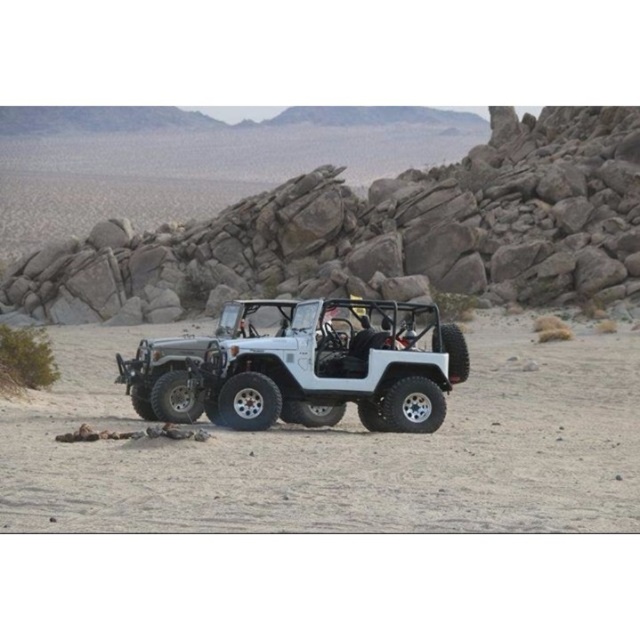
You are planning to set up a campsite in the desert. You have a tent that requires a flat area larger than the white matte jeep at center. Can the white matte sand at center provide enough space for your tent?

The white matte sand at center is bigger than the white matte jeep at center, so yes, the white matte sand at center can provide enough space for your tent since it is larger than the required area.